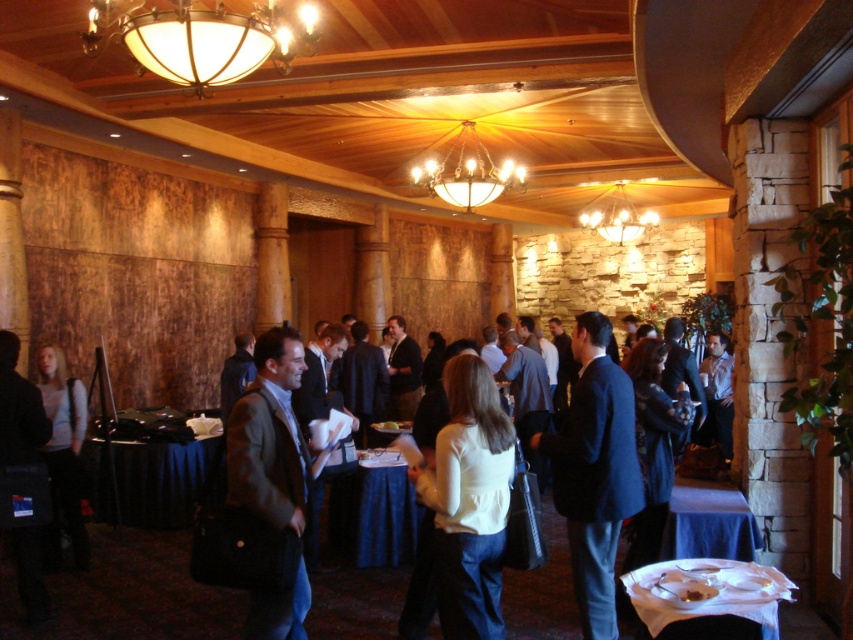
You are organizing a photo shoot and need to place a 1.2 meter tall mannequin where the dark blue suit at center is currently located. Is there enough space for the mannequin at that location?

The dark blue suit at center is located at point (595, 472), so there is enough space for the mannequin at that location.

You are a photographer at the event and want to capture a photo of the dark blue suit at center and the matte glass chandelier at upper center. However, you only have a camera with a 120cm height limit for framing. Can both objects fit within the frame vertically?

The dark blue suit at center is taller than the matte glass chandelier at upper center. Since the camera has a 120cm height limit, it depends on the combined height of both objects. If their total height exceeds 120cm, they won

You are at the networking event and want to move from the gold metallic chandelier at center to the white glossy table at lower right. Which direction should you move in?

The white glossy table at lower right is to the right of the gold metallic chandelier at center, so you should move to the right to reach it.